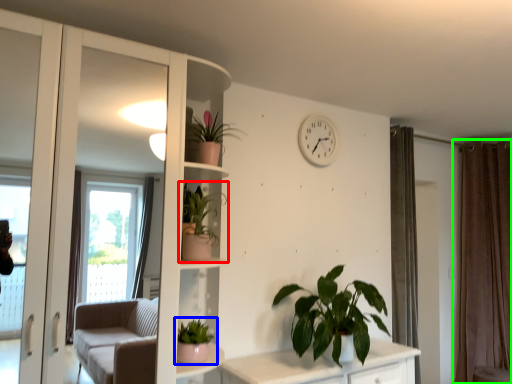
Question: Based on their relative distances, which object is farther from houseplant (highlighted by a red box)? Choose from houseplant (highlighted by a blue box) and curtain (highlighted by a green box).

Choices:
 (A) houseplant
 (B) curtain

Answer: (B)